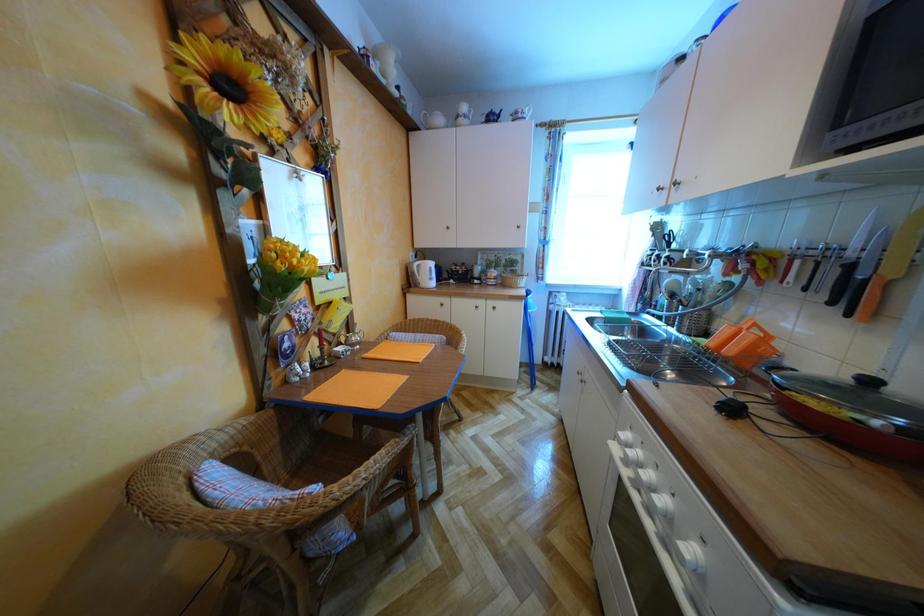
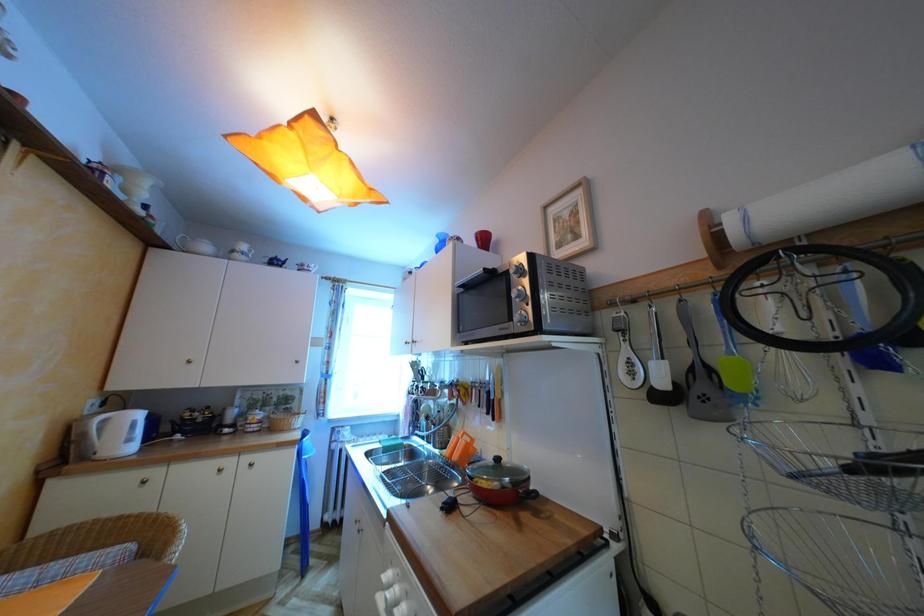
Based on the continuous images, in which direction is the camera rotating?

The rotation direction of the camera is right-up.